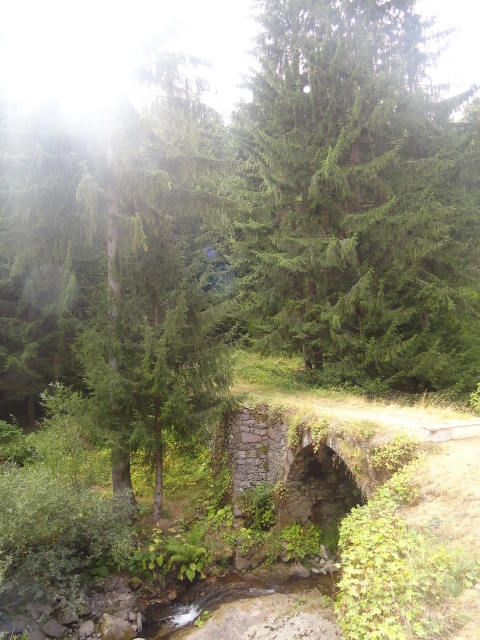
Between point (298, 173) and point (26, 352), which one is positioned in front?

Point (298, 173) is more forward.

Does green needle-like at center have a greater height compared to green matte tree at center?

In fact, green needle-like at center may be shorter than green matte tree at center.

Between point (363, 136) and point (129, 464), which one is positioned behind?

The point (363, 136) is behind.

Where is `green needle-like at center`? The height and width of the screenshot is (640, 480). green needle-like at center is located at coordinates (359, 198).

Which is in front, point (119, 433) or point (303, 486)?

Point (119, 433)

Between green matte tree at center and rusty stone bridge at center, which one appears on the left side from the viewer's perspective?

From the viewer's perspective, green matte tree at center appears more on the left side.

Describe the element at coordinates (117, 273) in the screenshot. The width and height of the screenshot is (480, 640). I see `green matte tree at center` at that location.

You are a GUI agent. You are given a task and a screenshot of the screen. Output one action in this format:
    pyautogui.click(x=<x>, y=<y>)
    Task: Click on the green matte tree at center
    Image resolution: width=480 pixels, height=640 pixels.
    Given the screenshot: What is the action you would take?
    pyautogui.click(x=117, y=273)

Is green needle-like at center to the right of rusty stone bridge at center from the viewer's perspective?

Yes, green needle-like at center is to the right of rusty stone bridge at center.

Who is taller, green needle-like at center or rusty stone bridge at center?

With more height is green needle-like at center.

You are a GUI agent. You are given a task and a screenshot of the screen. Output one action in this format:
    pyautogui.click(x=<x>, y=<y>)
    Task: Click on the green needle-like at center
    
    Given the screenshot: What is the action you would take?
    pyautogui.click(x=359, y=198)